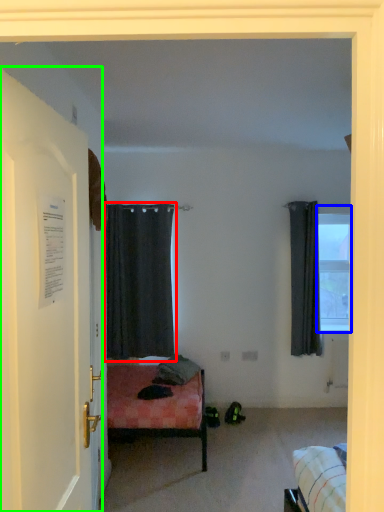
Question: Considering the real-world distances, which object is farthest from curtain (highlighted by a red box)? window (highlighted by a blue box) or door (highlighted by a green box)?

Choices:
 (A) window
 (B) door

Answer: (B)